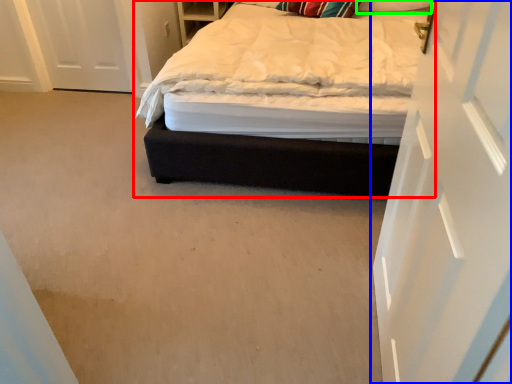
Question: Considering the real-world distances, which object is farthest from bed (highlighted by a red box)? door (highlighted by a blue box) or pillow (highlighted by a green box)?

Choices:
 (A) door
 (B) pillow

Answer: (B)